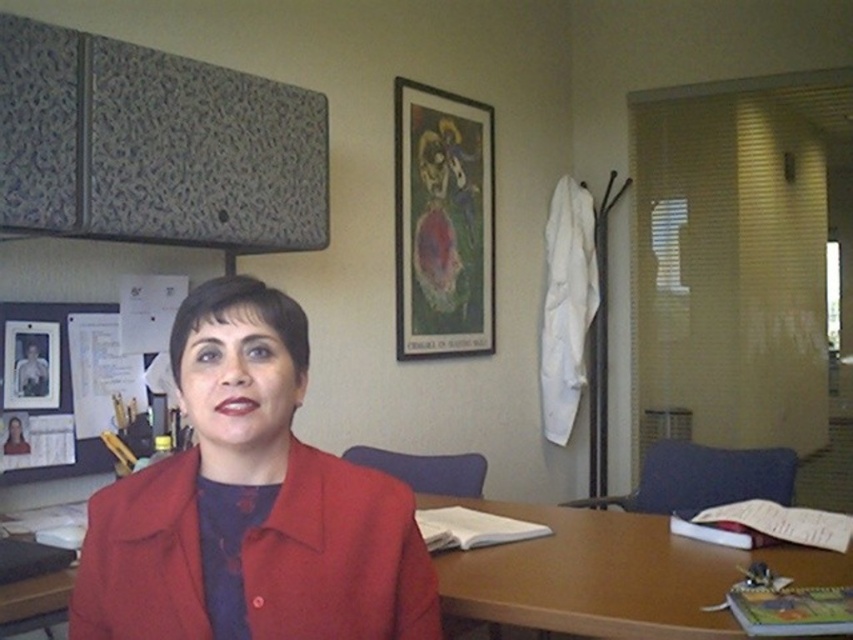
Based on the photo, is matte red jacket at center further to camera compared to metallic photo frame at upper left?

No, matte red jacket at center is in front of metallic photo frame at upper left.

Is point (190, 346) farther from viewer compared to point (54, 387)?

That is False.

Identify the location of matte red jacket at center. (250, 506).

Does matte red jacket at center appear on the left side of brown wooden table at center?

Yes, matte red jacket at center is to the left of brown wooden table at center.

Looking at this image, who is shorter, matte red jacket at center or brown wooden table at center?

brown wooden table at center is shorter.

This screenshot has height=640, width=853. What are the coordinates of `matte red jacket at center` in the screenshot? It's located at (250, 506).

Find the location of a particular element. The height and width of the screenshot is (640, 853). matte red jacket at center is located at coordinates (250, 506).

Does matte black picture frame at upper center appear under metallic photo frame at upper left?

Actually, matte black picture frame at upper center is above metallic photo frame at upper left.

Is matte black picture frame at upper center to the right of metallic photo frame at upper left from the viewer's perspective?

Yes, matte black picture frame at upper center is to the right of metallic photo frame at upper left.

Between point (430, 138) and point (9, 371), which one is positioned in front?

Point (9, 371) is in front.

At what (x,y) coordinates should I click in order to perform the action: click on matte black picture frame at upper center. Please return your answer as a coordinate pair (x, y). This screenshot has width=853, height=640. Looking at the image, I should click on (442, 221).